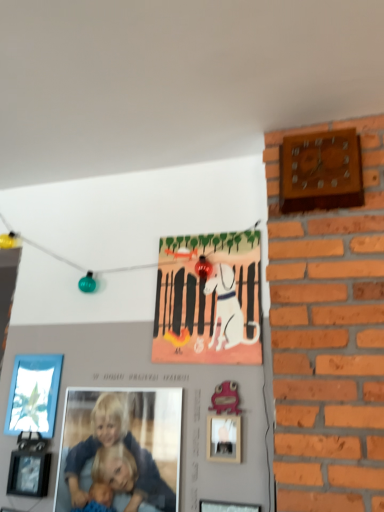
In the scene shown: What is the approximate width of black matte picture frame at lower left, positioned as the 3th picture frame in right-to-left order?

It is 5.02 centimeters.

Where is `black matte picture frame at lower left, which is the 2th picture frame from back to front`? The width and height of the screenshot is (384, 512). black matte picture frame at lower left, which is the 2th picture frame from back to front is located at coordinates click(x=29, y=473).

Where is `pink matte picture frame at center, marked as the 3th picture frame in a back-to-front arrangement`? pink matte picture frame at center, marked as the 3th picture frame in a back-to-front arrangement is located at coordinates (224, 438).

Measure the distance between point (41, 386) and camera.

The depth of point (41, 386) is 6.15 feet.

Find the location of a particular element. black matte picture frame at lower left, the 2th picture frame positioned from the left is located at coordinates (29, 473).

Does point (81, 446) come farther from viewer compared to point (47, 381)?

No, (81, 446) is closer to viewer.

From a real-world perspective, relative to matte glass picture frame at lower left, arranged as the 1th picture frame when viewed from the back, is matte blue shirt at center vertically above or below?

In terms of real-world spatial position, matte blue shirt at center is below matte glass picture frame at lower left, arranged as the 1th picture frame when viewed from the back.

From the image's perspective, is matte blue shirt at center above or below matte glass picture frame at lower left, arranged as the 1th picture frame when viewed from the back?

Clearly, from the image's perspective, matte blue shirt at center is below matte glass picture frame at lower left, arranged as the 1th picture frame when viewed from the back.

Is matte blue shirt at center oriented towards matte glass picture frame at lower left, which is the fourth picture frame in front-to-back order?

No, matte blue shirt at center does not turn towards matte glass picture frame at lower left, which is the fourth picture frame in front-to-back order.

Based on the photo, which of these two, matte glass picture frame at lower left, the fourth picture frame positioned from the right, or matte blue shirt at center, is thinner?

With smaller width is matte glass picture frame at lower left, the fourth picture frame positioned from the right.

Is matte blue shirt at center inside matte glass picture frame at lower left, the fourth picture frame positioned from the right?

No, matte blue shirt at center is not inside matte glass picture frame at lower left, the fourth picture frame positioned from the right.

Which is more to the right, matte glass picture frame at lower left, which is the fourth picture frame in front-to-back order, or matte blue shirt at center?

From the viewer's perspective, matte blue shirt at center appears more on the right side.

Between matte glass picture frame at lower left, arranged as the 1th picture frame when viewed from the back, and matte blue shirt at center, which one has more height?

With more height is matte blue shirt at center.

From the image's perspective, which is above, wooden picture frame at lower center, the fourth picture frame viewed from the back, or matte blue shirt at center?

matte blue shirt at center is shown above in the image.

From a real-world perspective, which object stands above the other?

In real-world perspective, matte blue shirt at center is above.

Is wooden picture frame at lower center, which is counted as the third picture frame, starting from the left, situated inside matte blue shirt at center or outside?

wooden picture frame at lower center, which is counted as the third picture frame, starting from the left, lies outside matte blue shirt at center.

Is wooden picture frame at lower center, the fourth picture frame viewed from the back, placed right next to matte blue shirt at center?

There is a gap between wooden picture frame at lower center, the fourth picture frame viewed from the back, and matte blue shirt at center.

From a real-world perspective, is wooden picture frame at lower center, the first picture frame from the front, below wooden wall clock at upper right?

Correct, in the physical world, wooden picture frame at lower center, the first picture frame from the front, is lower than wooden wall clock at upper right.

Is point (219, 505) positioned behind point (342, 138)?

No, it is in front of (342, 138).

Are wooden picture frame at lower center, the fourth picture frame viewed from the back, and wooden wall clock at upper right located far from each other?

Yes, wooden picture frame at lower center, the fourth picture frame viewed from the back, and wooden wall clock at upper right are located far from each other.

Would you say wooden wall clock at upper right is part of wooden picture frame at lower center, arranged as the second picture frame when viewed from the right,'s contents?

Definitely not — wooden wall clock at upper right is not inside wooden picture frame at lower center, arranged as the second picture frame when viewed from the right.

Measure the distance between black matte picture frame at lower left, the 2th picture frame positioned from the left, and wooden wall clock at upper right.

black matte picture frame at lower left, the 2th picture frame positioned from the left, is 5.01 feet away from wooden wall clock at upper right.

Is point (41, 462) closer or farther from the camera than point (352, 161)?

Point (41, 462) is positioned farther from the camera compared to point (352, 161).

From a real-world perspective, who is located higher, black matte picture frame at lower left, acting as the third picture frame starting from the front, or wooden wall clock at upper right?

In real-world perspective, wooden wall clock at upper right is above.

Based on the photo, based on their sizes in the image, would you say black matte picture frame at lower left, which is the 2th picture frame from back to front, is bigger or smaller than wooden wall clock at upper right?

Considering their sizes, black matte picture frame at lower left, which is the 2th picture frame from back to front, takes up less space than wooden wall clock at upper right.

Could you tell me if matte paper postcard at center is facing matte blue shirt at center?

No, matte paper postcard at center is not turned towards matte blue shirt at center.

Considering the relative positions of matte paper postcard at center and matte blue shirt at center in the image provided, is matte paper postcard at center to the left of matte blue shirt at center from the viewer's perspective?

No.

Looking at this image, is matte paper postcard at center touching matte blue shirt at center?

matte paper postcard at center and matte blue shirt at center are not in contact.

Is pink matte picture frame at center, marked as the 3th picture frame in a back-to-front arrangement, far from wooden picture frame at lower center, the first picture frame from the front?

No, pink matte picture frame at center, marked as the 3th picture frame in a back-to-front arrangement, is in close proximity to wooden picture frame at lower center, the first picture frame from the front.

From a real-world perspective, who is located lower, pink matte picture frame at center, the fourth picture frame in the left-to-right sequence, or wooden picture frame at lower center, arranged as the second picture frame when viewed from the right?

wooden picture frame at lower center, arranged as the second picture frame when viewed from the right, is physically lower.

Is pink matte picture frame at center, the 1th picture frame from the right, oriented towards wooden picture frame at lower center, which is counted as the third picture frame, starting from the left?

No, pink matte picture frame at center, the 1th picture frame from the right, is not aimed at wooden picture frame at lower center, which is counted as the third picture frame, starting from the left.

Considering the sizes of pink matte picture frame at center, which is the second picture frame in front-to-back order, and wooden picture frame at lower center, which is counted as the third picture frame, starting from the left, in the image, is pink matte picture frame at center, which is the second picture frame in front-to-back order, taller or shorter than wooden picture frame at lower center, which is counted as the third picture frame, starting from the left,?

In the image, pink matte picture frame at center, which is the second picture frame in front-to-back order, appears to be shorter than wooden picture frame at lower center, which is counted as the third picture frame, starting from the left.

Locate an element on the screen. the 2nd picture frame positioned above the matte blue shirt at center (from a real-world perspective) is located at coordinates (34, 394).

Where is `person below the matte glass picture frame at lower left, which is the fourth picture frame in front-to-back order (from the image's perspective)`? The image size is (384, 512). person below the matte glass picture frame at lower left, which is the fourth picture frame in front-to-back order (from the image's perspective) is located at coordinates (117, 459).

Looking at this image, from the image, which object appears to be nearer to black matte picture frame at lower left, the 2th picture frame positioned from the left, matte paper postcard at center or matte glass picture frame at lower left, the fourth picture frame positioned from the right?

Among the two, matte glass picture frame at lower left, the fourth picture frame positioned from the right, is located nearer to black matte picture frame at lower left, the 2th picture frame positioned from the left.

Which object lies nearer to the anchor point wooden wall clock at upper right, matte blue shirt at center or matte glass picture frame at lower left, the fourth picture frame positioned from the right?

The object closer to wooden wall clock at upper right is matte blue shirt at center.

Estimate the real-world distances between objects in this image. Which object is closer to pink matte picture frame at center, which is the second picture frame in front-to-back order, wooden picture frame at lower center, arranged as the second picture frame when viewed from the right, or matte glass picture frame at lower left, the fourth picture frame positioned from the right?

wooden picture frame at lower center, arranged as the second picture frame when viewed from the right, is closer to pink matte picture frame at center, which is the second picture frame in front-to-back order.

When comparing their distances from matte glass picture frame at lower left, which is the fourth picture frame in front-to-back order, does pink matte picture frame at center, the fourth picture frame in the left-to-right sequence, or matte paper postcard at center seem closer?

Among the two, matte paper postcard at center is located nearer to matte glass picture frame at lower left, which is the fourth picture frame in front-to-back order.

From the image, which object appears to be farther from wooden wall clock at upper right, pink matte picture frame at center, marked as the 3th picture frame in a back-to-front arrangement, or matte glass picture frame at lower left, which is the fourth picture frame in front-to-back order?

The object further to wooden wall clock at upper right is matte glass picture frame at lower left, which is the fourth picture frame in front-to-back order.

In the scene shown: Looking at the image, which one is located closer to matte blue shirt at center, wooden picture frame at lower center, the fourth picture frame viewed from the back, or wooden wall clock at upper right?

wooden picture frame at lower center, the fourth picture frame viewed from the back.

Looking at the image, which one is located further to wooden wall clock at upper right, matte blue shirt at center or matte paper postcard at center?

Based on the image, matte blue shirt at center appears to be further to wooden wall clock at upper right.

From the image, which object appears to be nearer to pink matte picture frame at center, the fourth picture frame in the left-to-right sequence, matte paper postcard at center or wooden picture frame at lower center, which is counted as the third picture frame, starting from the left?

wooden picture frame at lower center, which is counted as the third picture frame, starting from the left, is closer to pink matte picture frame at center, the fourth picture frame in the left-to-right sequence.

The width and height of the screenshot is (384, 512). Identify the location of postcard between matte glass picture frame at lower left, the fourth picture frame positioned from the right, and wooden picture frame at lower center, arranged as the second picture frame when viewed from the right, from left to right. pos(209,298).

Where is `person between matte paper postcard at center and wooden picture frame at lower center, the fourth picture frame viewed from the back, in the up-down direction`? This screenshot has height=512, width=384. person between matte paper postcard at center and wooden picture frame at lower center, the fourth picture frame viewed from the back, in the up-down direction is located at coordinates point(117,459).

Identify the location of postcard between matte glass picture frame at lower left, the first picture frame in the left-to-right sequence, and pink matte picture frame at center, the 1th picture frame from the right. The image size is (384, 512). (209, 298).

The width and height of the screenshot is (384, 512). I want to click on postcard between black matte picture frame at lower left, which is the 2th picture frame from back to front, and pink matte picture frame at center, the fourth picture frame in the left-to-right sequence, from left to right, so click(209, 298).